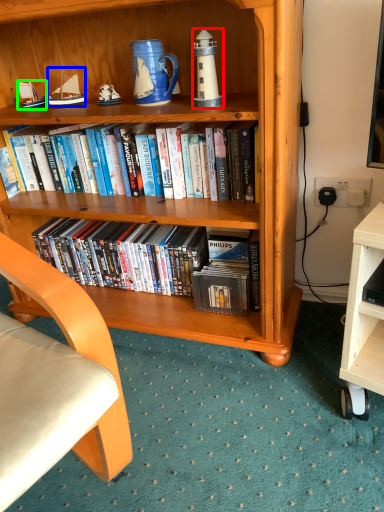
Question: Which is farther away from lamp (highlighted by a red box)? sailboat (highlighted by a blue box) or sailboat (highlighted by a green box)?

Choices:
 (A) sailboat
 (B) sailboat

Answer: (B)